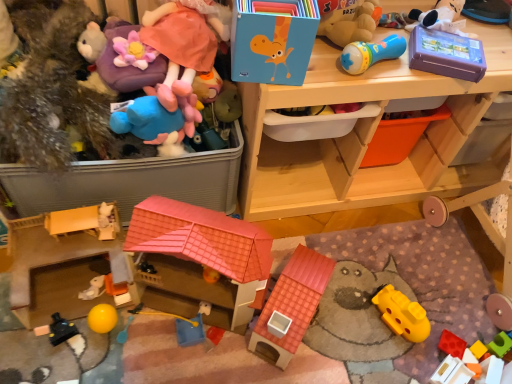
At what (x,y) coordinates should I click in order to perform the action: click on vacant space situated on the left part of yellow rubber ball at lower left, the fourth toy from the left. Please return your answer as a coordinate pair (x, y). Looking at the image, I should click on (42, 317).